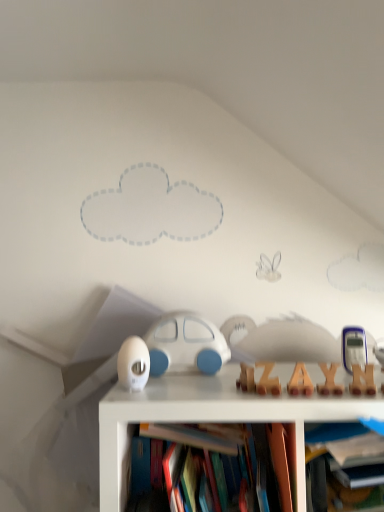
Question: Does white matte egg at center, the 2th toy from the back, lie behind hardcover book at center?

Choices:
 (A) no
 (B) yes

Answer: (B)

Question: Does white matte egg at center, which is the third toy from right to left, have a greater height compared to hardcover book at center?

Choices:
 (A) no
 (B) yes

Answer: (A)

Question: From a real-world perspective, does white matte egg at center, the first toy viewed from the left, stand above hardcover book at center?

Choices:
 (A) no
 (B) yes

Answer: (B)

Question: Does white matte egg at center, which is the third toy from right to left, have a smaller size compared to hardcover book at center?

Choices:
 (A) no
 (B) yes

Answer: (B)

Question: Is white matte egg at center, which is the third toy from right to left, positioned in front of hardcover book at center?

Choices:
 (A) no
 (B) yes

Answer: (A)

Question: Is white matte egg at center, which is the third toy from right to left, at the right side of hardcover book at center?

Choices:
 (A) no
 (B) yes

Answer: (A)

Question: Is hardcover book at center bigger than white matte egg at center, the second toy from the front?

Choices:
 (A) yes
 (B) no

Answer: (A)

Question: From a real-world perspective, is hardcover book at center positioned over white matte egg at center, the 2th toy from the back, based on gravity?

Choices:
 (A) no
 (B) yes

Answer: (A)

Question: Is the depth of hardcover book at center greater than that of white matte egg at center, the second toy from the front?

Choices:
 (A) yes
 (B) no

Answer: (B)

Question: Is hardcover book at center positioned in front of white matte egg at center, the 2th toy from the back?

Choices:
 (A) yes
 (B) no

Answer: (A)

Question: Does hardcover book at center appear on the left side of white matte egg at center, the first toy viewed from the left?

Choices:
 (A) yes
 (B) no

Answer: (B)

Question: Can you confirm if hardcover book at center is taller than white matte egg at center, the second toy from the front?

Choices:
 (A) no
 (B) yes

Answer: (B)

Question: From a real-world perspective, is hardcover book at center located beneath wooden letter at center, the third toy positioned from the left?

Choices:
 (A) no
 (B) yes

Answer: (B)